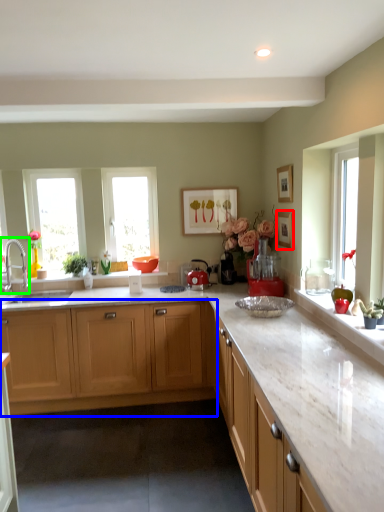
Question: Considering the real-world distances, which object is farthest from picture frame (highlighted by a red box)? cabinetry (highlighted by a blue box) or tap (highlighted by a green box)?

Choices:
 (A) cabinetry
 (B) tap

Answer: (B)